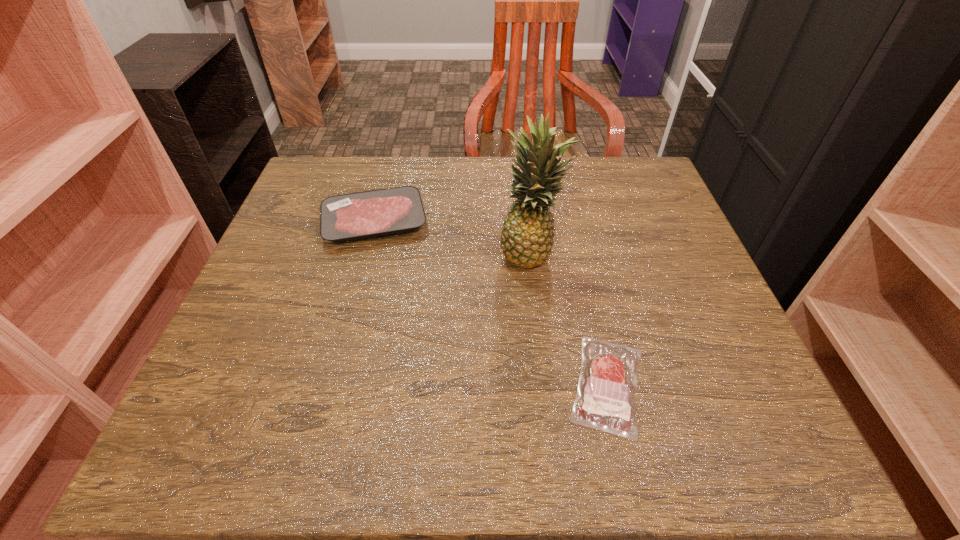
Locate an element on the screen. the tallest object is located at coordinates (527, 235).

Locate an element on the screen. Image resolution: width=960 pixels, height=540 pixels. the left steak is located at coordinates (348, 217).

You are a GUI agent. You are given a task and a screenshot of the screen. Output one action in this format:
    pyautogui.click(x=<x>, y=<y>)
    Task: Click on the second shortest object
    Image resolution: width=960 pixels, height=540 pixels.
    Given the screenshot: What is the action you would take?
    pyautogui.click(x=348, y=217)

The image size is (960, 540). What are the coordinates of `the right steak` in the screenshot? It's located at (607, 385).

Locate an element on the screen. This screenshot has height=540, width=960. the shorter steak is located at coordinates pyautogui.click(x=607, y=385).

Locate an element on the screen. free spot located 0.110m on the right of the pineapple is located at coordinates (615, 254).

The width and height of the screenshot is (960, 540). I want to click on vacant space located 0.360m on the front of the taller steak, so click(x=327, y=403).

Locate an element on the screen. The height and width of the screenshot is (540, 960). free point located on the left of the shorter steak is located at coordinates pos(444,384).

Locate an element on the screen. object that is at the far edge is located at coordinates (348, 217).

Find the location of a particular element. object that is at the near edge is located at coordinates (607, 385).